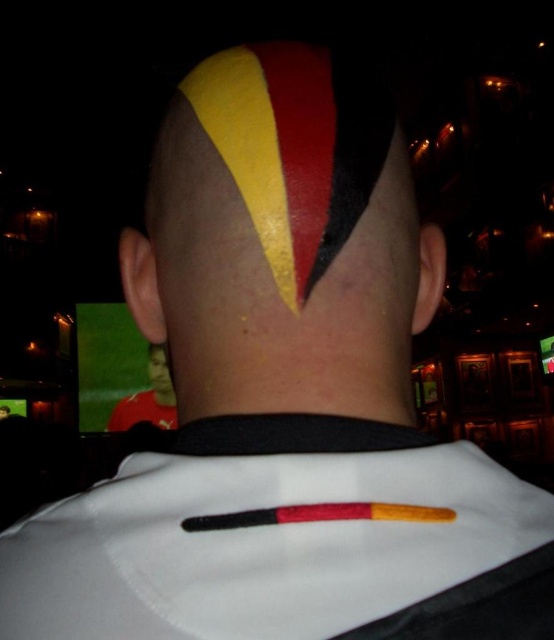
Is white cotton dress shirt at center to the right of matte black hair at center from the viewer's perspective?

Incorrect, white cotton dress shirt at center is not on the right side of matte black hair at center.

Is white cotton dress shirt at center to the left of matte black hair at center from the viewer's perspective?

Correct, you'll find white cotton dress shirt at center to the left of matte black hair at center.

Is point (134, 472) behind point (170, 132)?

No, it is not.

The width and height of the screenshot is (554, 640). Identify the location of white cotton dress shirt at center. (288, 541).

From the picture: Does matte black hair at center come behind matte yellow face at center?

No, it is not.

The image size is (554, 640). Identify the location of matte black hair at center. (283, 241).

The image size is (554, 640). In order to click on matte black hair at center in this screenshot , I will do `click(283, 241)`.

Find the location of a particular element. The height and width of the screenshot is (640, 554). matte black hair at center is located at coordinates (283, 241).

Is matte black hair at center below black wood crayon at center?

No.

Who is higher up, matte black hair at center or black wood crayon at center?

Positioned higher is matte black hair at center.

This screenshot has width=554, height=640. In order to click on matte black hair at center in this screenshot , I will do `click(283, 241)`.